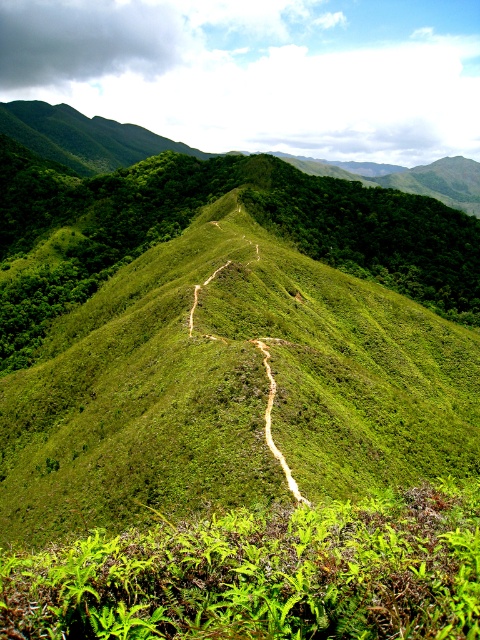
What do you see at coordinates (192, 216) in the screenshot?
I see `green leafy vegetation at center` at bounding box center [192, 216].

Does green leafy vegetation at center have a greater height compared to dirt path at center?

Yes, green leafy vegetation at center is taller than dirt path at center.

The width and height of the screenshot is (480, 640). Describe the element at coordinates (192, 216) in the screenshot. I see `green leafy vegetation at center` at that location.

Image resolution: width=480 pixels, height=640 pixels. What are the coordinates of `green leafy vegetation at center` in the screenshot? It's located at (192, 216).

Between green leafy ferns at center and dirt path at center, which one is positioned lower?

green leafy ferns at center is lower down.

Which is more to the left, green leafy ferns at center or dirt path at center?

green leafy ferns at center

Image resolution: width=480 pixels, height=640 pixels. Identify the location of green leafy ferns at center. (263, 573).

At what (x,y) coordinates should I click in order to perform the action: click on green leafy ferns at center. Please return your answer as a coordinate pair (x, y). The width and height of the screenshot is (480, 640). Looking at the image, I should click on (263, 573).

Can you confirm if green leafy vegetation at center is smaller than green grassy hill at upper left?

Indeed, green leafy vegetation at center has a smaller size compared to green grassy hill at upper left.

Is point (27, 236) positioned in front of point (108, 157)?

Yes, point (27, 236) is in front of point (108, 157).

At what (x,y) coordinates should I click in order to perform the action: click on green leafy vegetation at center. Please return your answer as a coordinate pair (x, y). The height and width of the screenshot is (640, 480). Looking at the image, I should click on (192, 216).